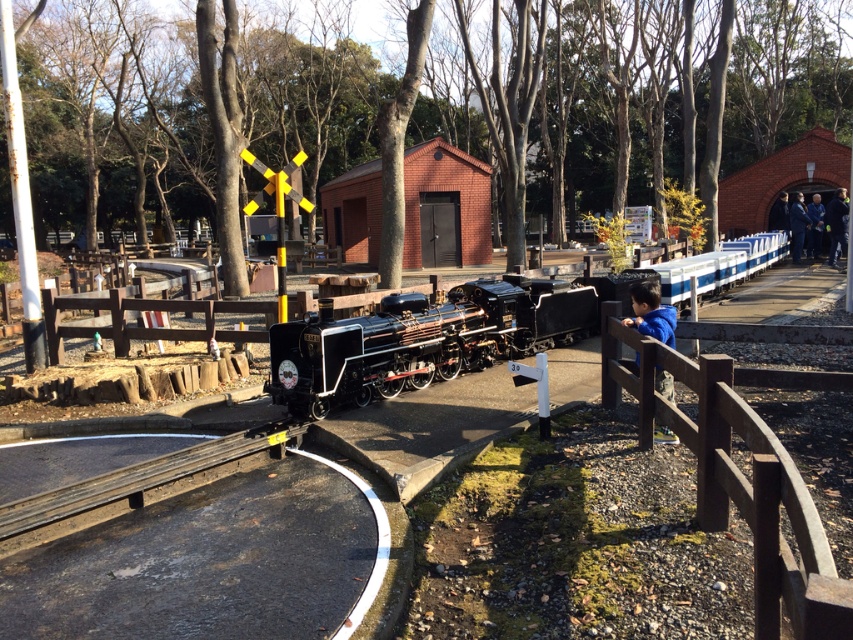
Can you confirm if brown wooden fence at center is positioned to the right of blue fleece jacket at center?

In fact, brown wooden fence at center is to the left of blue fleece jacket at center.

Does point (788, 497) come in front of point (646, 320)?

Yes.

This screenshot has height=640, width=853. In order to click on brown wooden fence at center in this screenshot , I will do click(x=737, y=480).

Which is behind, point (283, 388) or point (720, 387)?

The point (283, 388) is behind.

Is polished black locomotive at center to the left of brown wooden fence at center from the viewer's perspective?

In fact, polished black locomotive at center is to the right of brown wooden fence at center.

Where is `polished black locomotive at center`? This screenshot has width=853, height=640. polished black locomotive at center is located at coordinates (422, 337).

Is point (750, 426) positioned after point (103, 481)?

No, it is in front of (103, 481).

Is brown wooden fence at center to the right of black rubber train track at lower center from the viewer's perspective?

Yes, brown wooden fence at center is to the right of black rubber train track at lower center.

Consider the image. Who is more forward, (668, 368) or (3, 531)?

Point (3, 531) is more forward.

This screenshot has height=640, width=853. I want to click on brown wooden fence at center, so (x=737, y=480).